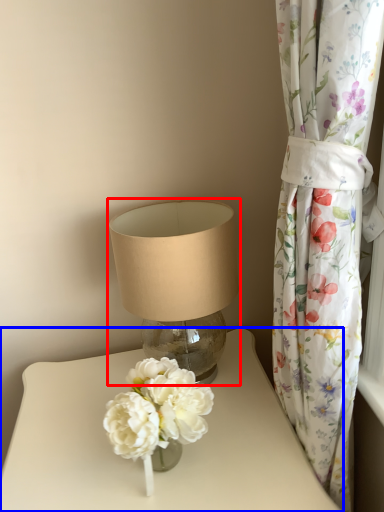
Question: Which point is closer to the camera, lamp (highlighted by a red box) or table (highlighted by a blue box)?

Choices:
 (A) lamp
 (B) table

Answer: (B)